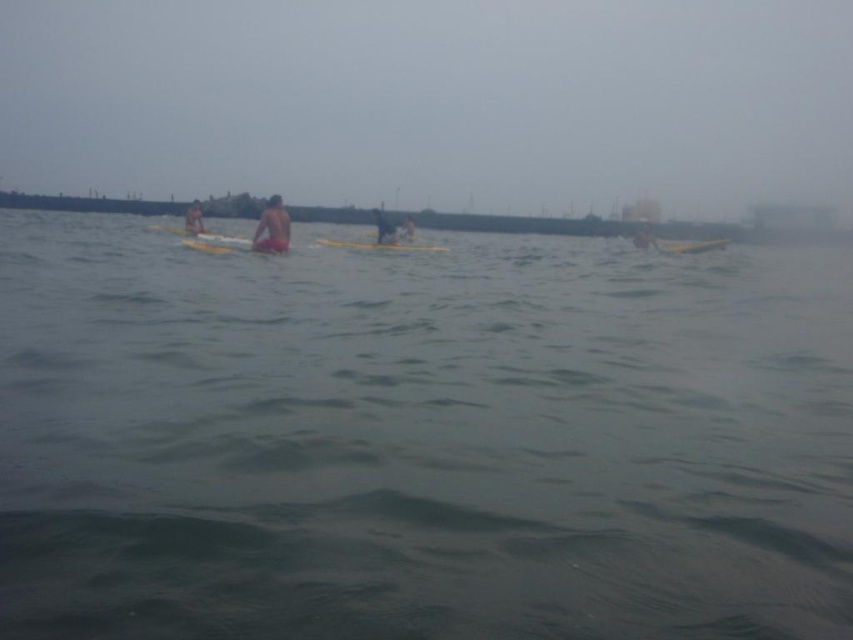
You are a photographer trying to capture a shot of the orange fabric person at center and the yellow foam at center. Which object should you focus on first if you want to ensure both are in the frame without moving the camera? Explain your reasoning based on their sizes in the image.

The orange fabric person at center is much taller than the yellow foam at center, so focusing on the taller orange fabric person at center first would ensure the yellow foam at center remains in the frame as it is smaller and positioned similarly.